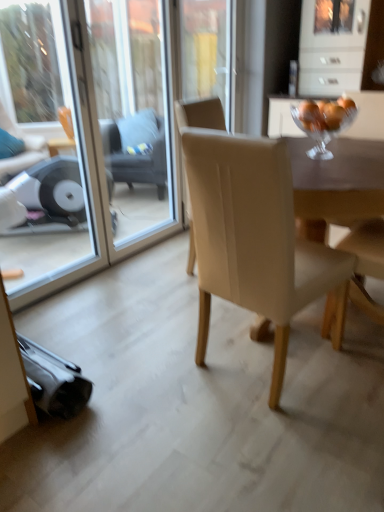
Question: From the image's perspective, relative to dark gray fabric swivel chair at center, is transparent glass screen door at upper center, which appears as the 2th screen door when viewed from the left, above or below?

Choices:
 (A) below
 (B) above

Answer: (A)

Question: Would you say transparent glass screen door at upper center, the 1th screen door when ordered from right to left, is to the left or to the right of dark gray fabric swivel chair at center in the picture?

Choices:
 (A) right
 (B) left

Answer: (A)

Question: Which of these objects is positioned farthest from the dark gray fabric swivel chair at center?

Choices:
 (A) transparent glass screen door at upper center, which appears as the 2th screen door when viewed from the left
 (B) transparent glass screen door at left, marked as the second screen door in a right-to-left arrangement
 (C) beige fabric chair at center
 (D) clear glass bowl at upper right
 (E) matte beige armchair at right

Answer: (C)

Question: Estimate the real-world distances between objects in this image. Which object is closer to the matte beige armchair at right?

Choices:
 (A) clear glass bowl at upper right
 (B) dark gray fabric swivel chair at center
 (C) transparent glass screen door at upper center, the 1th screen door when ordered from right to left
 (D) transparent glass screen door at left, which is counted as the 1th screen door, starting from the left
 (E) beige fabric chair at center

Answer: (E)